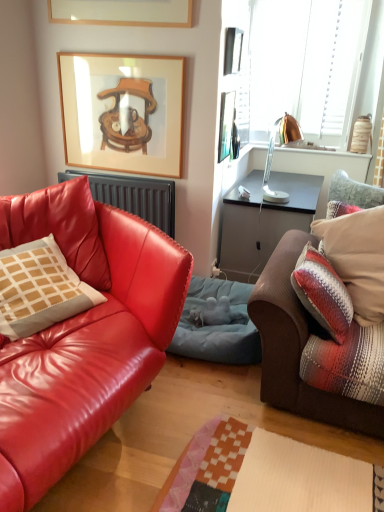
Question: In terms of height, does matte leather couch at left, the 2th studio couch positioned from the right, look taller or shorter compared to plush brown couch at right, placed as the 2th studio couch when sorted from left to right?

Choices:
 (A) short
 (B) tall

Answer: (B)

Question: From the image's perspective, is matte leather couch at left, the first studio couch in the left-to-right sequence, located above or below plush brown couch at right, placed as the 1th studio couch when sorted from right to left?

Choices:
 (A) below
 (B) above

Answer: (A)

Question: Which of these objects is positioned closest to the matte black radiator at left?

Choices:
 (A) plaid fabric pillow at right, the first pillow positioned from the right
 (B) metallic silver picture frame at upper right, positioned as the 2th picture frame in left-to-right order
 (C) metallic silver picture frame at upper center, marked as the third picture frame in a left-to-right arrangement
 (D) wooden picture frame at upper center, acting as the 3th picture frame starting from the right
 (E) matte leather couch at left, the first studio couch in the left-to-right sequence

Answer: (D)

Question: Estimate the real-world distances between objects in this image. Which object is farther from the plush brown couch at right, placed as the 1th studio couch when sorted from right to left?

Choices:
 (A) matte black radiator at left
 (B) blue fabric pet bed at center
 (C) metallic silver picture frame at upper right, the 2th picture frame in the right-to-left sequence
 (D) metallic silver picture frame at upper center, acting as the 1th picture frame starting from the right
 (E) matte leather couch at left, the 2th studio couch positioned from the right

Answer: (D)